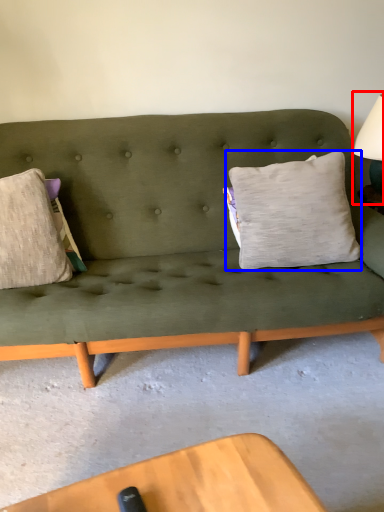
Question: Which object is closer to the camera taking this photo, table lamp (highlighted by a red box) or pillow (highlighted by a blue box)?

Choices:
 (A) table lamp
 (B) pillow

Answer: (B)